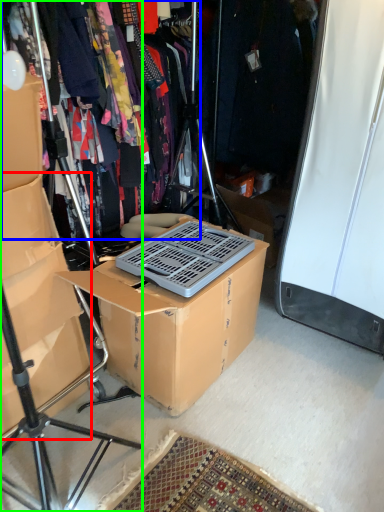
Question: Considering the real-world distances, which object is farthest from storage box (highlighted by a red box)? clothing (highlighted by a blue box) or tripod (highlighted by a green box)?

Choices:
 (A) clothing
 (B) tripod

Answer: (A)